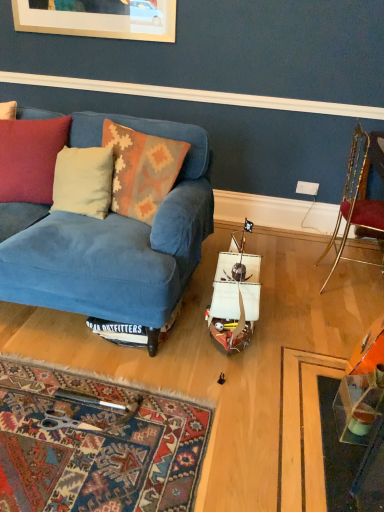
This screenshot has width=384, height=512. I want to click on free space in front of transparent plastic table at lower right, so click(x=339, y=468).